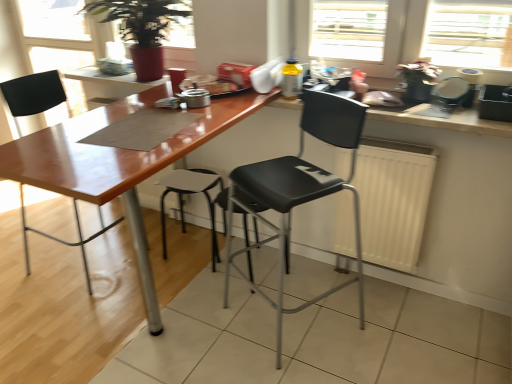
Find the location of a particular element. This screenshot has height=384, width=512. vacant area to the left of matte black chair at left, which is the second chair from right to left is located at coordinates pos(24,258).